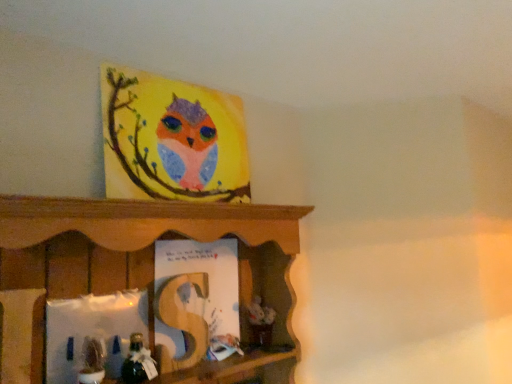
Question: Considering the relative sizes of shiny metallic toy at lower left, which ranks as the second toy in left-to-right order, and matte green plant at lower left, arranged as the 1th toy when viewed from the left, in the image provided, is shiny metallic toy at lower left, which ranks as the second toy in left-to-right order, wider than matte green plant at lower left, arranged as the 1th toy when viewed from the left,?

Choices:
 (A) no
 (B) yes

Answer: (B)

Question: Does shiny metallic toy at lower left, which appears as the first toy when viewed from the right, have a larger size compared to matte green plant at lower left, arranged as the 1th toy when viewed from the left?

Choices:
 (A) yes
 (B) no

Answer: (B)

Question: Is shiny metallic toy at lower left, which ranks as the second toy in left-to-right order, oriented towards matte green plant at lower left, arranged as the 1th toy when viewed from the left?

Choices:
 (A) no
 (B) yes

Answer: (A)

Question: From a real-world perspective, is shiny metallic toy at lower left, which appears as the first toy when viewed from the right, below matte green plant at lower left, acting as the second toy starting from the right?

Choices:
 (A) yes
 (B) no

Answer: (A)

Question: Does shiny metallic toy at lower left, which ranks as the second toy in left-to-right order, have a greater height compared to matte green plant at lower left, acting as the second toy starting from the right?

Choices:
 (A) no
 (B) yes

Answer: (A)

Question: From a real-world perspective, is shiny metallic toy at lower left, which appears as the first toy when viewed from the right, on top of matte green plant at lower left, arranged as the 1th toy when viewed from the left?

Choices:
 (A) yes
 (B) no

Answer: (B)

Question: Is matte paper book at center positioned before shiny metallic toy at lower left, which ranks as the second toy in left-to-right order?

Choices:
 (A) yes
 (B) no

Answer: (B)

Question: Is matte paper book at center not close to shiny metallic toy at lower left, which appears as the first toy when viewed from the right?

Choices:
 (A) yes
 (B) no

Answer: (B)

Question: Are matte paper book at center and shiny metallic toy at lower left, which appears as the first toy when viewed from the right, making contact?

Choices:
 (A) no
 (B) yes

Answer: (A)

Question: Is matte paper book at center completely or partially outside of shiny metallic toy at lower left, which appears as the first toy when viewed from the right?

Choices:
 (A) yes
 (B) no

Answer: (A)

Question: From a real-world perspective, does matte paper book at center stand above shiny metallic toy at lower left, which appears as the first toy when viewed from the right?

Choices:
 (A) no
 (B) yes

Answer: (B)

Question: Is shiny metallic toy at lower left, which ranks as the second toy in left-to-right order, a part of matte paper book at center?

Choices:
 (A) yes
 (B) no

Answer: (B)

Question: Is shiny metallic toy at lower left, which appears as the first toy when viewed from the right, smaller than matte paper book at center?

Choices:
 (A) yes
 (B) no

Answer: (A)